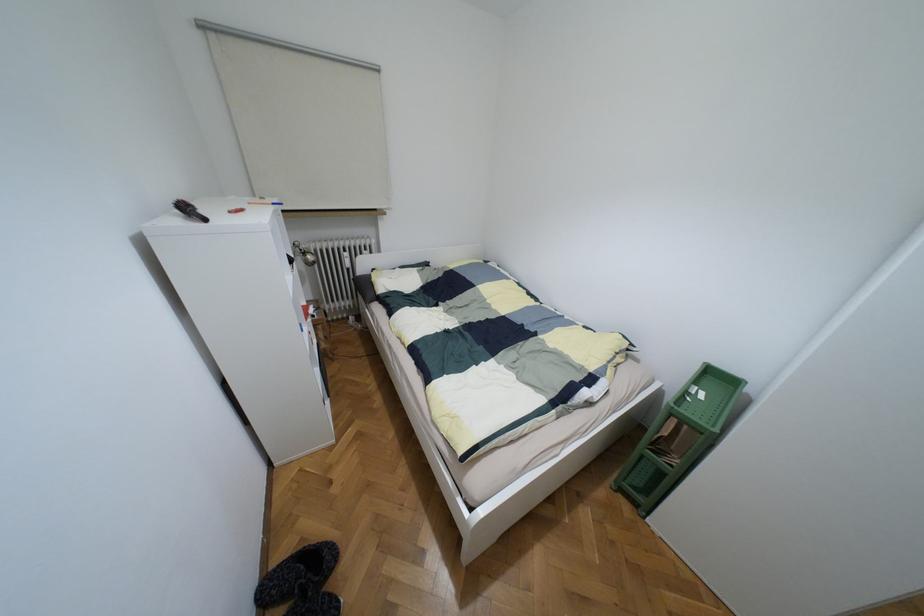
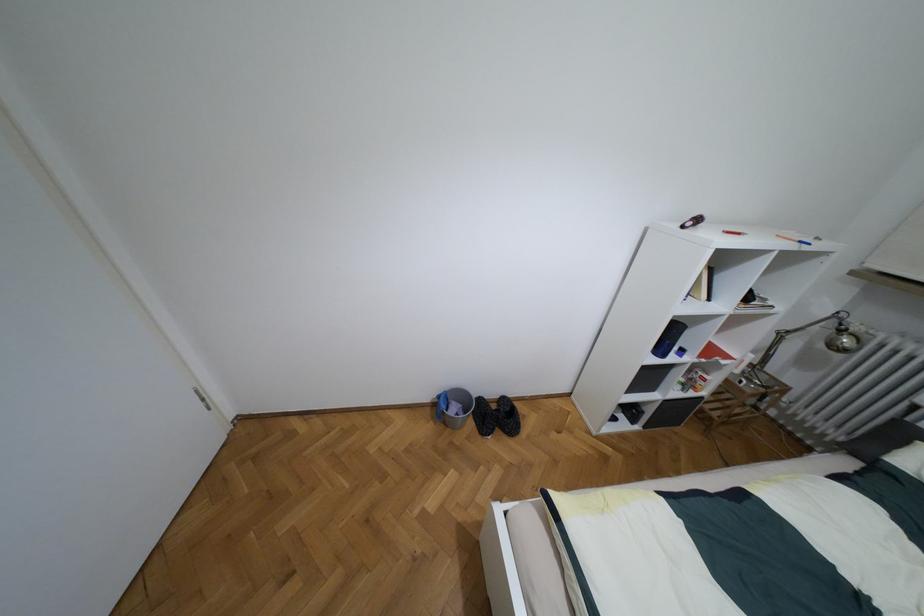
First-person continuous shooting, in which direction is the camera rotating?

The camera's rotation is toward left-down.